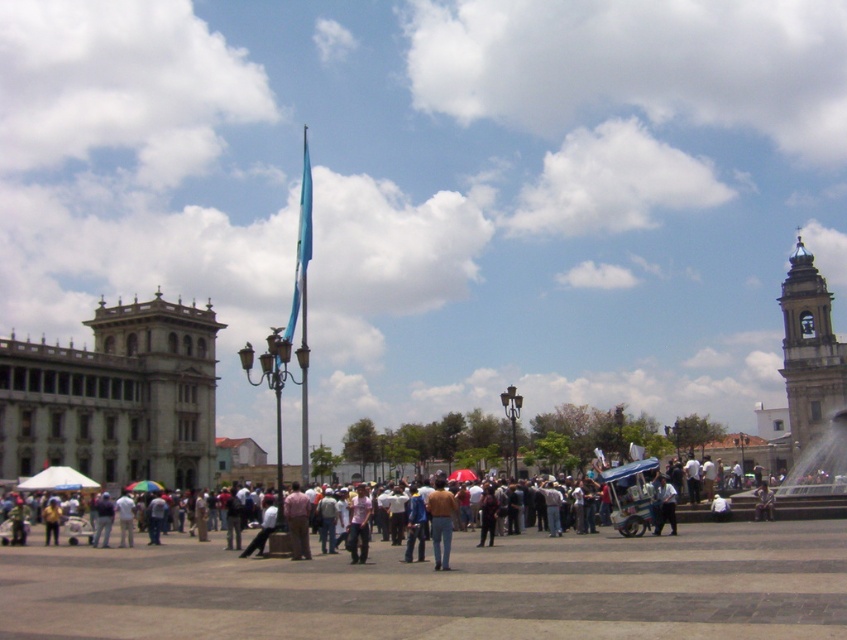
Question: Is the position of metallic fountain at right more distant than that of blue fabric flag pole at center?

Choices:
 (A) no
 (B) yes

Answer: (B)

Question: Which point appears farthest from the camera in this image?

Choices:
 (A) (309, 557)
 (B) (805, 435)

Answer: (B)

Question: Which is farther from the gold metallic bell tower at right?

Choices:
 (A) pink fabric shirt at center
 (B) metallic fountain at right

Answer: (A)

Question: Among these objects, which one is farthest from the camera?

Choices:
 (A) blue fabric flag pole at center
 (B) brown leather jacket at center
 (C) metallic fountain at right

Answer: (C)

Question: Does metallic fountain at right have a lesser width compared to blue fabric flag pole at center?

Choices:
 (A) yes
 (B) no

Answer: (B)

Question: Can you confirm if blue fabric flag pole at center is positioned above pink fabric shirt at center?

Choices:
 (A) yes
 (B) no

Answer: (A)